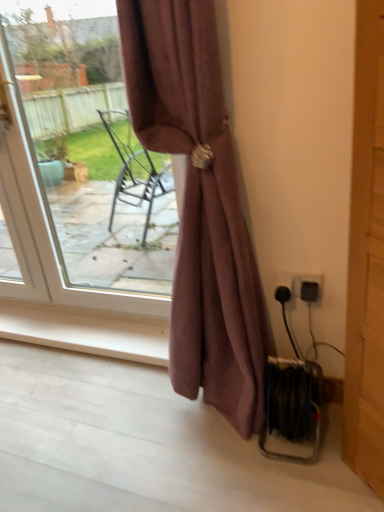
Question: Should I look upward or downward to see matte white door at upper left?

Choices:
 (A) up
 (B) down

Answer: (A)

Question: Is mauve fabric curtain at center shorter than black plastic socket at lower right, the first electric outlet when ordered from left to right?

Choices:
 (A) no
 (B) yes

Answer: (A)

Question: Does mauve fabric curtain at center have a greater width compared to black plastic socket at lower right, the first electric outlet when ordered from left to right?

Choices:
 (A) no
 (B) yes

Answer: (B)

Question: From the image's perspective, is mauve fabric curtain at center over black plastic socket at lower right, the first electric outlet when ordered from left to right?

Choices:
 (A) yes
 (B) no

Answer: (A)

Question: Considering the relative positions of mauve fabric curtain at center and black plastic socket at lower right, the first electric outlet when ordered from left to right, in the image provided, is mauve fabric curtain at center in front of black plastic socket at lower right, the first electric outlet when ordered from left to right,?

Choices:
 (A) no
 (B) yes

Answer: (B)

Question: From a real-world perspective, is mauve fabric curtain at center physically below black plastic socket at lower right, the first electric outlet when ordered from left to right?

Choices:
 (A) no
 (B) yes

Answer: (A)

Question: Is mauve fabric curtain at center at the right side of black plastic socket at lower right, the first electric outlet when ordered from left to right?

Choices:
 (A) yes
 (B) no

Answer: (B)

Question: Is mauve fabric curtain at center aimed at black plastic electric outlet at lower right, which is counted as the second electric outlet, starting from the left?

Choices:
 (A) no
 (B) yes

Answer: (A)

Question: Does mauve fabric curtain at center have a greater height compared to black plastic electric outlet at lower right, acting as the first electric outlet starting from the right?

Choices:
 (A) yes
 (B) no

Answer: (A)

Question: From the image's perspective, is mauve fabric curtain at center under black plastic electric outlet at lower right, which is counted as the second electric outlet, starting from the left?

Choices:
 (A) yes
 (B) no

Answer: (B)

Question: Is mauve fabric curtain at center wider than black plastic electric outlet at lower right, which is counted as the second electric outlet, starting from the left?

Choices:
 (A) yes
 (B) no

Answer: (A)

Question: Is mauve fabric curtain at center not near black plastic electric outlet at lower right, which is counted as the second electric outlet, starting from the left?

Choices:
 (A) yes
 (B) no

Answer: (B)

Question: Is mauve fabric curtain at center looking in the opposite direction of black plastic electric outlet at lower right, acting as the first electric outlet starting from the right?

Choices:
 (A) no
 (B) yes

Answer: (A)

Question: Is black plastic socket at lower right, placed as the 2th electric outlet when sorted from right to left, oriented away from matte white door at upper left?

Choices:
 (A) no
 (B) yes

Answer: (A)